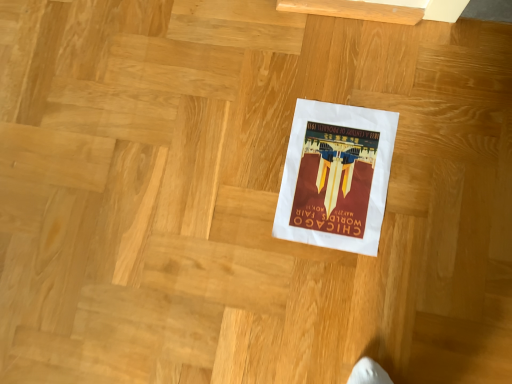
In order to click on vacant area that is in front of white paper poster at center in this screenshot , I will do `click(402, 275)`.